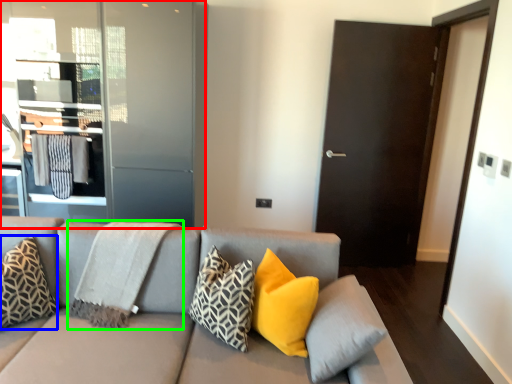
Question: Based on their relative distances, which object is nearer to elevator (highlighted by a red box)? Choose from pillow (highlighted by a blue box) and blanket (highlighted by a green box).

Choices:
 (A) pillow
 (B) blanket

Answer: (B)